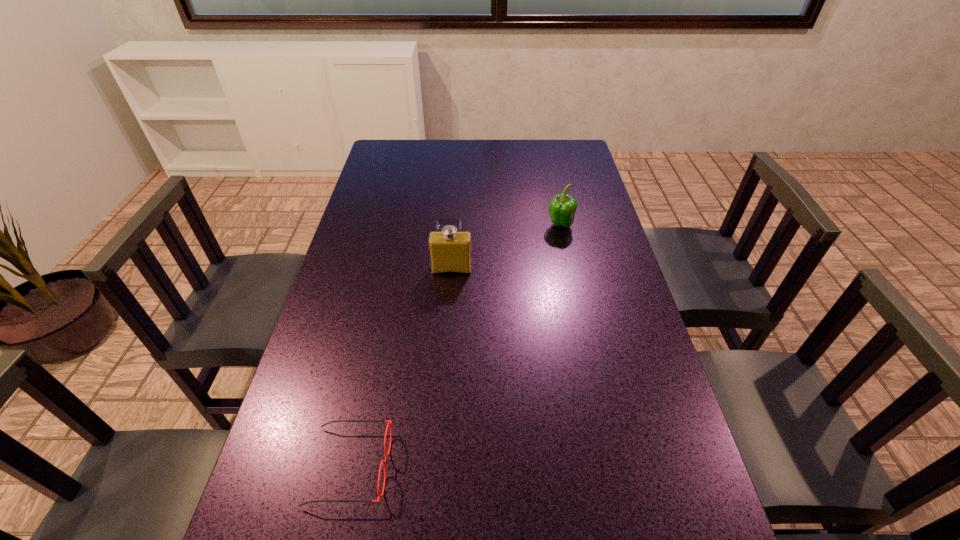
Identify the location of object at the right edge. (562, 208).

Locate an element on the screen. The image size is (960, 540). vacant region at the far edge of the desktop is located at coordinates (436, 166).

The height and width of the screenshot is (540, 960). I want to click on free region at the left edge of the desktop, so pos(315,397).

Image resolution: width=960 pixels, height=540 pixels. Find the location of `vacant space at the right edge`. vacant space at the right edge is located at coordinates (592, 377).

Where is `vacant space at the far right corner of the desktop`? This screenshot has width=960, height=540. vacant space at the far right corner of the desktop is located at coordinates click(542, 144).

This screenshot has height=540, width=960. In order to click on free space between the tallest object and the leftmost object in this screenshot , I will do `click(400, 368)`.

Find the location of a particular element. vacant point located between the second object from left to right and the spectacles is located at coordinates (400, 368).

Image resolution: width=960 pixels, height=540 pixels. In order to click on free spot between the second farthest object and the shortest object in this screenshot , I will do `click(400, 368)`.

You are a GUI agent. You are given a task and a screenshot of the screen. Output one action in this format:
    pyautogui.click(x=<x>, y=<y>)
    Task: Click on the free space between the spectacles and the bell pepper
    The width and height of the screenshot is (960, 540).
    Given the screenshot: What is the action you would take?
    pyautogui.click(x=455, y=346)

I want to click on free area in between the second object from right to left and the nearest object, so (x=400, y=368).